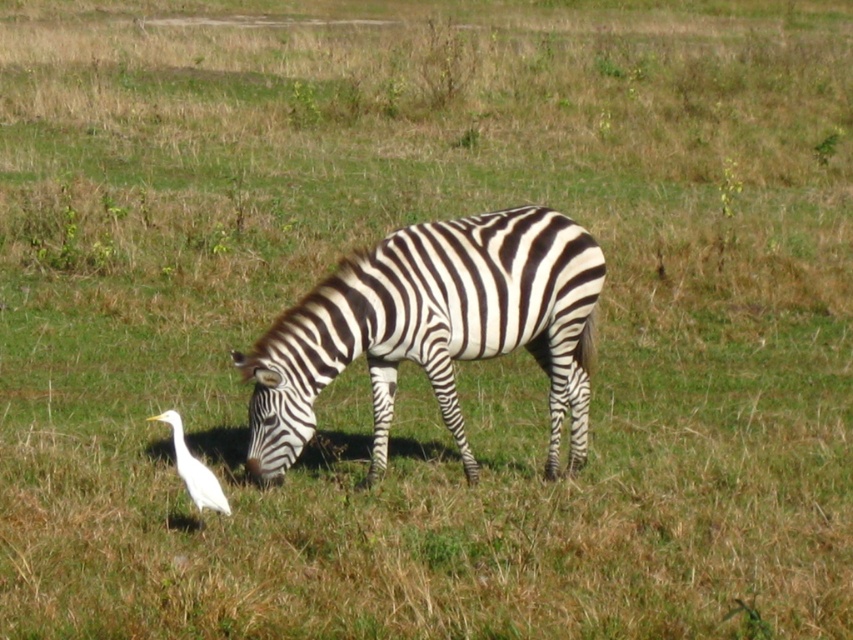
Question: Is black and white striped zebra at center thinner than white matte bird at lower left?

Choices:
 (A) yes
 (B) no

Answer: (B)

Question: Which point is farther to the camera?

Choices:
 (A) (514, 348)
 (B) (213, 480)

Answer: (A)

Question: Which point is farther to the camera?

Choices:
 (A) black and white striped zebra at center
 (B) white matte bird at lower left

Answer: (A)

Question: Is black and white striped zebra at center wider than white matte bird at lower left?

Choices:
 (A) no
 (B) yes

Answer: (B)

Question: Which point appears closest to the camera in this image?

Choices:
 (A) (596, 259)
 (B) (187, 481)

Answer: (B)

Question: Can you confirm if black and white striped zebra at center is bigger than white matte bird at lower left?

Choices:
 (A) yes
 (B) no

Answer: (A)